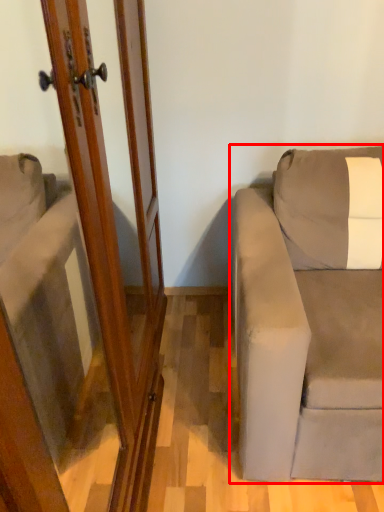
Question: From the image's perspective, where is studio couch (annotated by the red box) located relative to screen door?

Choices:
 (A) below
 (B) above

Answer: (A)